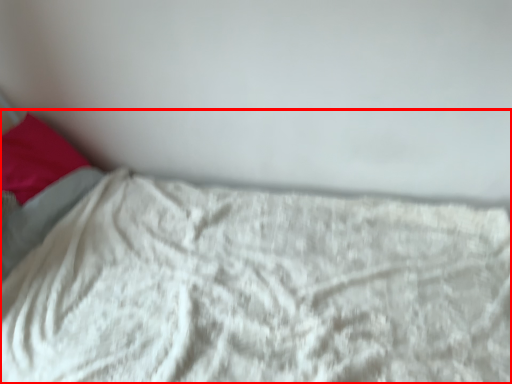
Question: From the image's perspective, considering the relative positions of bed (annotated by the red box) and pillow in the image provided, where is bed (annotated by the red box) located with respect to the staircase?

Choices:
 (A) above
 (B) below

Answer: (B)